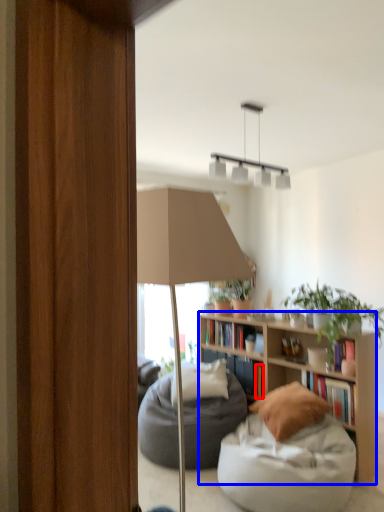
Question: Which object appears farthest to the camera in this image, book (highlighted by a red box) or bookcase (highlighted by a blue box)?

Choices:
 (A) book
 (B) bookcase

Answer: (A)